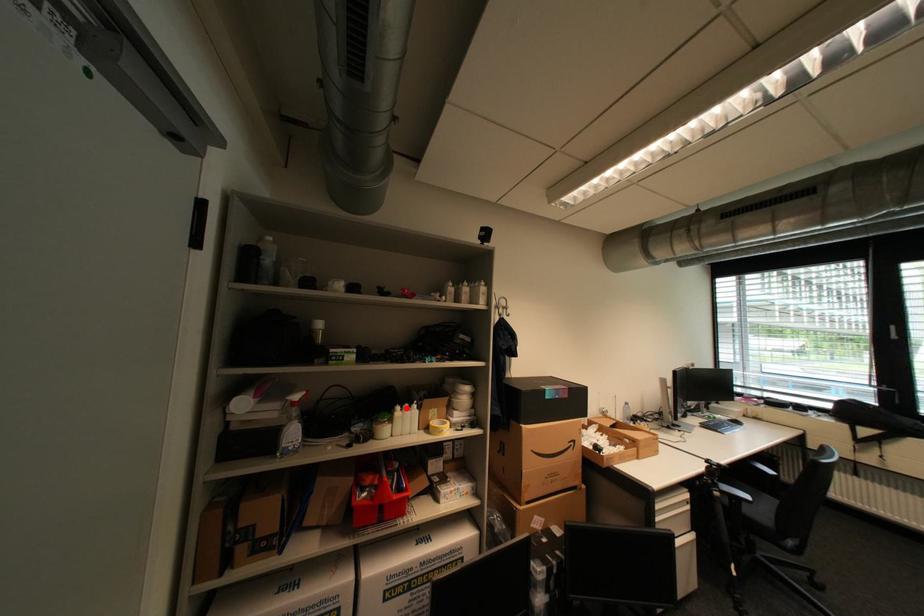
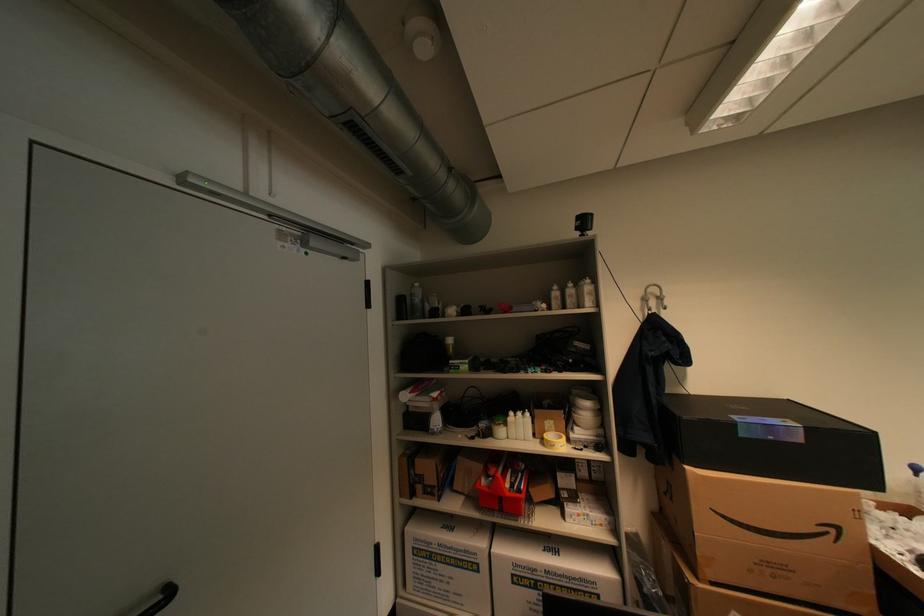
Question: I am providing you with two images of the same scene from different viewpoints. In image1, a red point is highlighted. Considering the same 3D point in image2, which of the following is correct?

Choices:
 (A) It is closer
 (B) It is farther

Answer: (B)